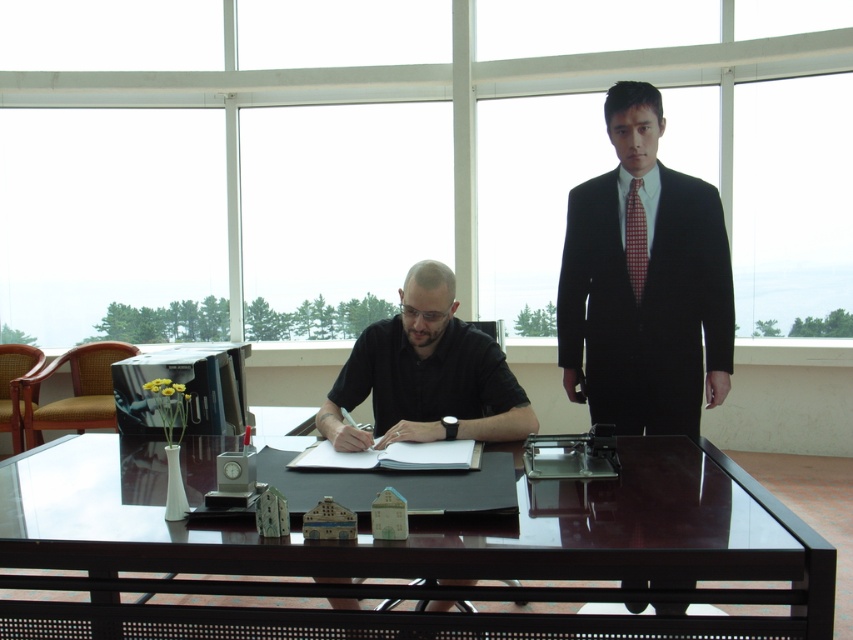
Question: Can you confirm if glossy dark wood table at center is positioned to the right of red checkered tie at right?

Choices:
 (A) yes
 (B) no

Answer: (B)

Question: Which object is farther from the camera taking this photo?

Choices:
 (A) matte black suit at right
 (B) black smooth shirt at center
 (C) glossy dark wood table at center

Answer: (A)

Question: Is glossy dark wood table at center thinner than red checkered tie at right?

Choices:
 (A) yes
 (B) no

Answer: (B)

Question: Estimate the real-world distances between objects in this image. Which object is closer to the black smooth shirt at center?

Choices:
 (A) red checkered tie at right
 (B) matte black suit at right

Answer: (B)

Question: Among these points, which one is farthest from the camera?

Choices:
 (A) (479, 538)
 (B) (451, 278)
 (C) (642, 120)
 (D) (640, 204)

Answer: (D)

Question: Is glossy dark wood table at center closer to the viewer compared to red checkered tie at right?

Choices:
 (A) yes
 (B) no

Answer: (A)